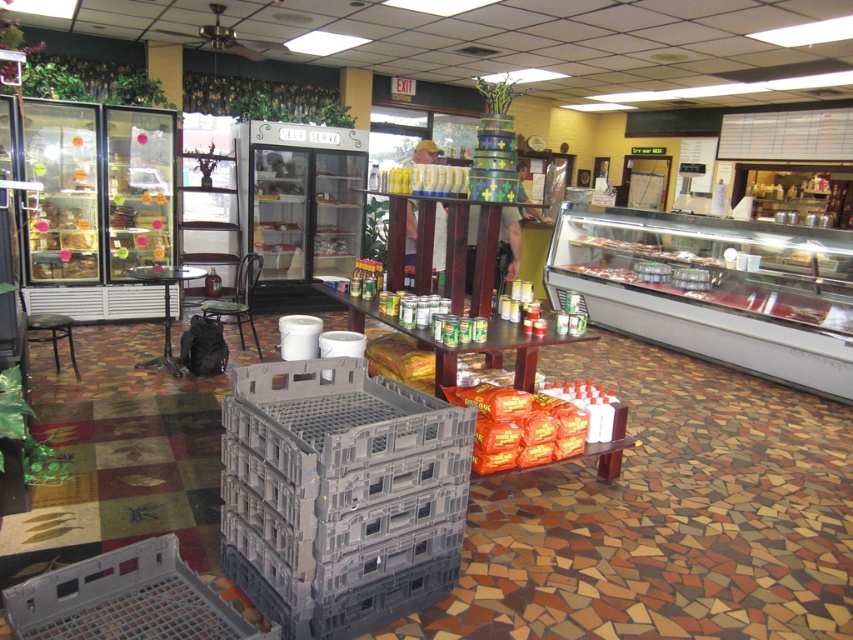
You are a delivery person who needs to place a large box that is 30 cm thick. You see the gray plastic crate at center and the black plastic stool at lower left. Which object can support the box based on their thickness?

The black plastic stool at lower left can support the large box since it is thicker than the gray plastic crate at center, which may not provide enough structural support due to its thinner build.

You are a delivery person who just arrived at the store. You need to place a large box that is 3 meters long. Can you fit it between the gray plastic crate at center and the black plastic stool at lower left without bending it?

The distance between the gray plastic crate at center and the black plastic stool at lower left is 2.75 meters. Since the box is 3 meters long, it cannot fit straight between them without bending.